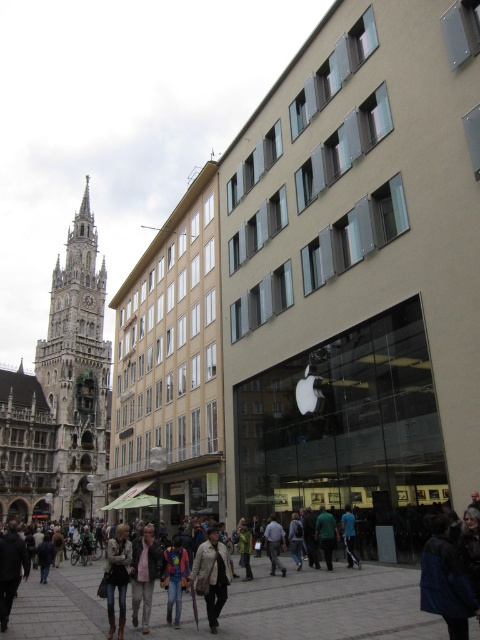
Is light brown leather jacket at center to the right of dark blue jeans at center from the viewer's perspective?

Incorrect, light brown leather jacket at center is not on the right side of dark blue jeans at center.

Between point (139, 541) and point (349, 520), which one is positioned in front?

Point (139, 541)

Between point (146, 596) and point (344, 515), which one is positioned in front?

Point (146, 596)

Where is `light brown leather jacket at center`? light brown leather jacket at center is located at coordinates (144, 573).

Between light beige coat at center and denim jacket at lower left, which one has more height?

Standing taller between the two is denim jacket at lower left.

Does point (207, 600) lie in front of point (118, 557)?

That is True.

This screenshot has height=640, width=480. What do you see at coordinates (212, 576) in the screenshot?
I see `light beige coat at center` at bounding box center [212, 576].

I want to click on light beige coat at center, so click(x=212, y=576).

Consider the image. Who is higher up, golden stone tower at left or dark green jacket at center?

golden stone tower at left is above.

Is point (36, 372) positioned after point (327, 540)?

Yes, it is behind point (327, 540).

The width and height of the screenshot is (480, 640). What are the coordinates of `golden stone tower at left` in the screenshot? It's located at (78, 371).

Image resolution: width=480 pixels, height=640 pixels. I want to click on golden stone tower at left, so click(x=78, y=371).